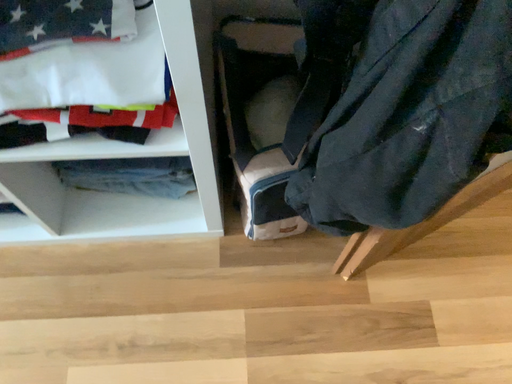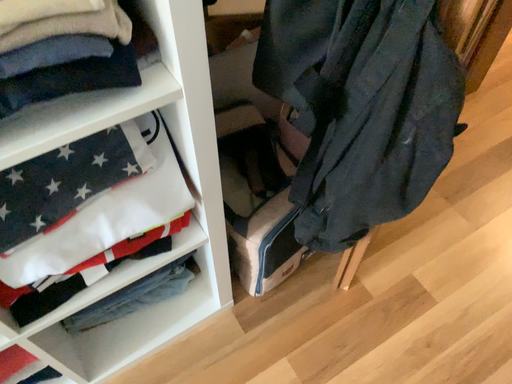
Question: How did the camera likely rotate when shooting the video?

Choices:
 (A) rotated left
 (B) rotated right

Answer: (B)